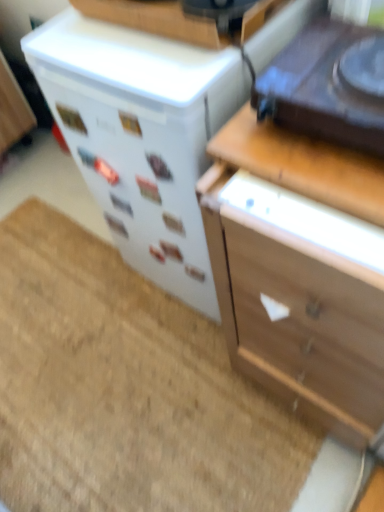
The width and height of the screenshot is (384, 512). What are the coordinates of `shiny black turntable at upper right, which is the 2th appliance from back to front` in the screenshot? It's located at (322, 88).

Image resolution: width=384 pixels, height=512 pixels. What do you see at coordinates (322, 88) in the screenshot? I see `shiny black turntable at upper right, which is the first appliance from front to back` at bounding box center [322, 88].

Where is `beige carpet at lower left`? beige carpet at lower left is located at coordinates (124, 389).

Considering the sizes of objects white glossy refrigerator at center-left, which is the 2th appliance from front to back, and shiny black turntable at upper right, which is the 2th appliance from back to front, in the image provided, who is wider, white glossy refrigerator at center-left, which is the 2th appliance from front to back, or shiny black turntable at upper right, which is the 2th appliance from back to front,?

white glossy refrigerator at center-left, which is the 2th appliance from front to back.

From the image's perspective, which one is positioned higher, white glossy refrigerator at center-left, which ranks as the first appliance in back-to-front order, or shiny black turntable at upper right, which is the 2th appliance from back to front?

white glossy refrigerator at center-left, which ranks as the first appliance in back-to-front order.

Is white glossy refrigerator at center-left, which ranks as the first appliance in back-to-front order, touching shiny black turntable at upper right, which is the first appliance from front to back?

No.

How different are the orientations of white glossy refrigerator at center-left, which is the 2th appliance from front to back, and shiny black turntable at upper right, which is the first appliance from front to back, in degrees?

The angle between the facing direction of white glossy refrigerator at center-left, which is the 2th appliance from front to back, and the facing direction of shiny black turntable at upper right, which is the first appliance from front to back, is 1.7 degrees.

Who is taller, beige carpet at lower left or white glossy refrigerator at center-left, which is the 2th appliance from front to back?

white glossy refrigerator at center-left, which is the 2th appliance from front to back, is taller.

What are the coordinates of `doormat that appears below the white glossy refrigerator at center-left, which ranks as the first appliance in back-to-front order (from the image's perspective)` in the screenshot? It's located at (124, 389).

From the image's perspective, would you say beige carpet at lower left is positioned over white glossy refrigerator at center-left, which is the 2th appliance from front to back?

No, from the image's perspective, beige carpet at lower left is not on top of white glossy refrigerator at center-left, which is the 2th appliance from front to back.

Can you tell me how much beige carpet at lower left and white glossy refrigerator at center-left, which ranks as the first appliance in back-to-front order, differ in facing direction?

88.8 degrees.

Is beige carpet at lower left a part of shiny black turntable at upper right, which is the 2th appliance from back to front?

That's incorrect, beige carpet at lower left is not inside shiny black turntable at upper right, which is the 2th appliance from back to front.

Does point (306, 55) come farther from viewer compared to point (101, 249)?

No, it is in front of (101, 249).

Is shiny black turntable at upper right, which is the 2th appliance from back to front, taller or shorter than beige carpet at lower left?

Considering their sizes, shiny black turntable at upper right, which is the 2th appliance from back to front, has more height than beige carpet at lower left.

Is point (367, 334) behind point (291, 157)?

No, (367, 334) is in front of (291, 157).

From a real-world perspective, is wooden chest of drawers at right physically located above or below wooden at upper right?

wooden chest of drawers at right is below wooden at upper right.

Does wooden chest of drawers at right come behind wooden at upper right?

No, wooden chest of drawers at right is closer to the viewer.

Measure the distance between wooden chest of drawers at right and wooden at upper right.

wooden chest of drawers at right is 5.56 inches away from wooden at upper right.

Consider the image. From a real-world perspective, which is physically below, white glossy refrigerator at center-left, which is the 2th appliance from front to back, or wooden at upper right?

In real-world perspective, white glossy refrigerator at center-left, which is the 2th appliance from front to back, is lower.

Consider the image. Based on their sizes in the image, would you say white glossy refrigerator at center-left, which is the 2th appliance from front to back, is bigger or smaller than wooden at upper right?

In the image, white glossy refrigerator at center-left, which is the 2th appliance from front to back, appears to be larger than wooden at upper right.

Consider the image. From the image's perspective, which one is positioned lower, white glossy refrigerator at center-left, which is the 2th appliance from front to back, or wooden at upper right?

wooden at upper right appears lower in the image.

Is point (199, 91) closer to viewer compared to point (249, 128)?

Yes, point (199, 91) is closer to viewer.

In the scene shown: Between wooden chest of drawers at right and white glossy refrigerator at center-left, which ranks as the first appliance in back-to-front order, which one has larger size?

wooden chest of drawers at right is bigger.

What's the angular difference between wooden chest of drawers at right and white glossy refrigerator at center-left, which is the 2th appliance from front to back,'s facing directions?

There is a 0.58-degree angle between the facing directions of wooden chest of drawers at right and white glossy refrigerator at center-left, which is the 2th appliance from front to back.

From the image's perspective, is wooden chest of drawers at right positioned above or below white glossy refrigerator at center-left, which ranks as the first appliance in back-to-front order?

From the image's perspective, wooden chest of drawers at right appears below white glossy refrigerator at center-left, which ranks as the first appliance in back-to-front order.

Which is behind, shiny black turntable at upper right, which is the 2th appliance from back to front, or wooden at upper right?

wooden at upper right is further from the camera.

Is shiny black turntable at upper right, which is the 2th appliance from back to front, oriented towards wooden at upper right?

No, shiny black turntable at upper right, which is the 2th appliance from back to front, is not oriented towards wooden at upper right.

Between shiny black turntable at upper right, which is the 2th appliance from back to front, and wooden at upper right, which one has larger size?

shiny black turntable at upper right, which is the 2th appliance from back to front, is bigger.

Based on the photo, would you say shiny black turntable at upper right, which is the 2th appliance from back to front, is inside or outside wooden at upper right?

shiny black turntable at upper right, which is the 2th appliance from back to front, is not enclosed by wooden at upper right.

Where is `appliance to the left of shiny black turntable at upper right, which is the first appliance from front to back`? This screenshot has width=384, height=512. appliance to the left of shiny black turntable at upper right, which is the first appliance from front to back is located at coordinates click(x=141, y=136).

The height and width of the screenshot is (512, 384). I want to click on the 1st appliance in front of the beige carpet at lower left, so click(141, 136).

Looking at the image, which one is located further to wooden chest of drawers at right, wooden at upper right or white glossy refrigerator at center-left, which is the 2th appliance from front to back?

The object further to wooden chest of drawers at right is white glossy refrigerator at center-left, which is the 2th appliance from front to back.

Considering their positions, is wooden at upper right positioned closer to beige carpet at lower left than wooden chest of drawers at right?

The object closer to beige carpet at lower left is wooden chest of drawers at right.

From the image, which object appears to be nearer to wooden at upper right, white glossy refrigerator at center-left, which is the 2th appliance from front to back, or shiny black turntable at upper right, which is the first appliance from front to back?

Among the two, shiny black turntable at upper right, which is the first appliance from front to back, is located nearer to wooden at upper right.

Based on their spatial positions, is wooden at upper right or beige carpet at lower left further from shiny black turntable at upper right, which is the 2th appliance from back to front?

Among the two, beige carpet at lower left is located further to shiny black turntable at upper right, which is the 2th appliance from back to front.

Considering their positions, is beige carpet at lower left positioned further to shiny black turntable at upper right, which is the first appliance from front to back, than wooden chest of drawers at right?

beige carpet at lower left lies further to shiny black turntable at upper right, which is the first appliance from front to back, than the other object.

Estimate the real-world distances between objects in this image. Which object is further from shiny black turntable at upper right, which is the first appliance from front to back, wooden chest of drawers at right or white glossy refrigerator at center-left, which is the 2th appliance from front to back?

white glossy refrigerator at center-left, which is the 2th appliance from front to back.

When comparing their distances from wooden at upper right, does shiny black turntable at upper right, which is the 2th appliance from back to front, or wooden chest of drawers at right seem further?

wooden chest of drawers at right lies further to wooden at upper right than the other object.

Estimate the real-world distances between objects in this image. Which object is closer to white glossy refrigerator at center-left, which is the 2th appliance from front to back, wooden at upper right or shiny black turntable at upper right, which is the first appliance from front to back?

wooden at upper right.

You are a GUI agent. You are given a task and a screenshot of the screen. Output one action in this format:
    pyautogui.click(x=<x>, y=<y>)
    Task: Click on the appliance located between white glossy refrigerator at center-left, which ranks as the first appliance in back-to-front order, and wooden chest of drawers at right in the left-right direction
    The image size is (384, 512).
    Given the screenshot: What is the action you would take?
    (322, 88)

What are the coordinates of `counter top located between beige carpet at lower left and shiny black turntable at upper right, which is the 2th appliance from back to front, in the left-right direction` in the screenshot? It's located at (303, 164).

Where is `counter top between white glossy refrigerator at center-left, which is the 2th appliance from front to back, and beige carpet at lower left, in the vertical direction`? This screenshot has width=384, height=512. counter top between white glossy refrigerator at center-left, which is the 2th appliance from front to back, and beige carpet at lower left, in the vertical direction is located at coordinates (303, 164).

Identify the location of counter top situated between beige carpet at lower left and wooden chest of drawers at right from left to right. (303, 164).